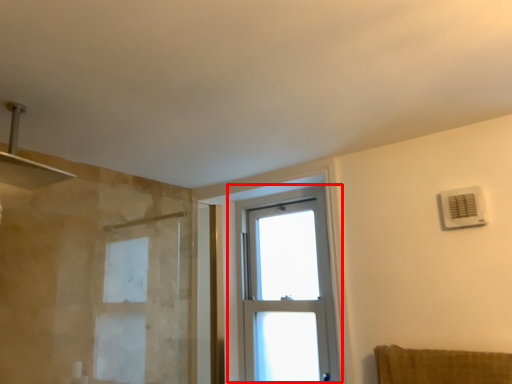
Question: From the image's perspective, what is the correct spatial positioning of window (annotated by the red box) in reference to air conditioning?

Choices:
 (A) below
 (B) above

Answer: (A)